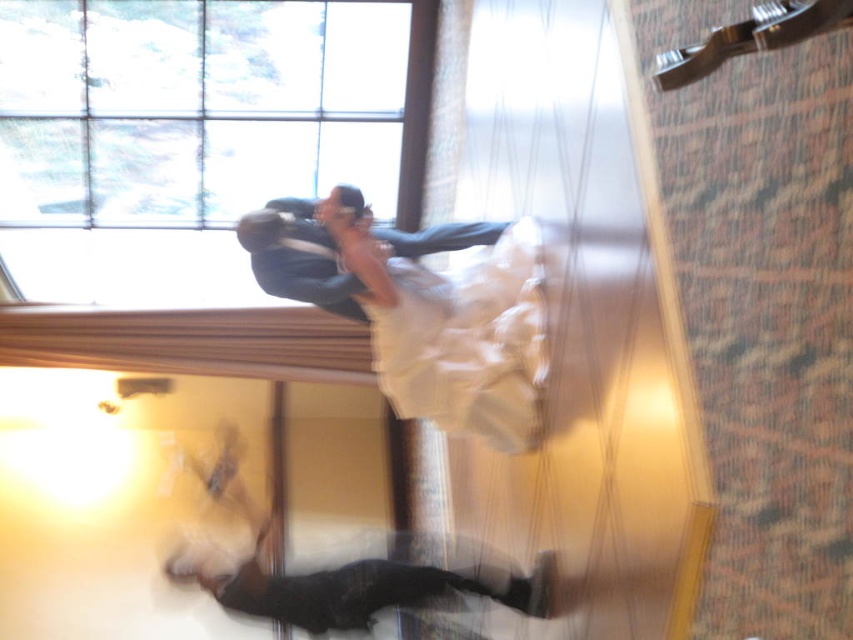
Question: Does white satin dress at center appear on the left side of shiny dark blue suit at upper center?

Choices:
 (A) no
 (B) yes

Answer: (A)

Question: Observing the image, what is the correct spatial positioning of white satin dress at center in reference to shiny dark blue suit at upper center?

Choices:
 (A) right
 (B) left

Answer: (A)

Question: Which point is farther from the camera taking this photo?

Choices:
 (A) (463, 266)
 (B) (268, 224)

Answer: (A)

Question: Which point appears farthest from the camera in this image?

Choices:
 (A) (393, 355)
 (B) (355, 305)

Answer: (B)

Question: Can you confirm if white satin dress at center is positioned to the right of shiny dark blue suit at upper center?

Choices:
 (A) no
 (B) yes

Answer: (B)

Question: Which object appears closest to the camera in this image?

Choices:
 (A) white satin dress at center
 (B) shiny dark blue suit at upper center

Answer: (A)